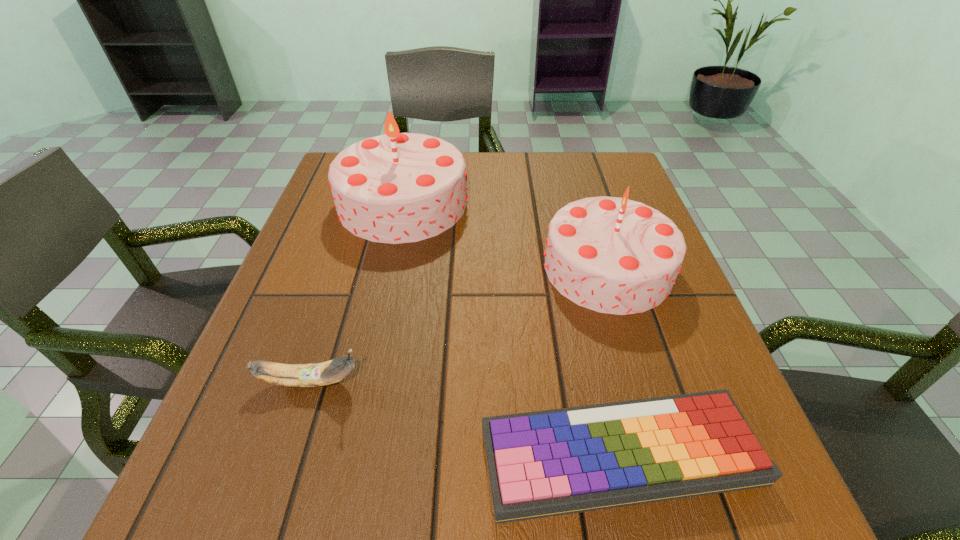
Identify the location of free location at the far edge of the desktop. (482, 171).

Where is `vacant space at the left edge`? vacant space at the left edge is located at coordinates (348, 294).

Where is `free region at the far right corner of the desktop`? Image resolution: width=960 pixels, height=540 pixels. free region at the far right corner of the desktop is located at coordinates (590, 166).

The height and width of the screenshot is (540, 960). I want to click on vacant area that lies between the left birthday cake and the banana, so click(x=357, y=292).

The height and width of the screenshot is (540, 960). Find the location of `vacant region between the third farthest object and the left birthday cake`. vacant region between the third farthest object and the left birthday cake is located at coordinates (357, 292).

At what (x,y) coordinates should I click in order to perform the action: click on free space between the right birthday cake and the taller birthday cake. Please return your answer as a coordinate pair (x, y). Looking at the image, I should click on [x=506, y=235].

This screenshot has height=540, width=960. I want to click on free point between the second shortest object and the tallest object, so coord(357,292).

At what (x,y) coordinates should I click in order to perform the action: click on free space between the banana and the third shortest object. Please return your answer as a coordinate pair (x, y). Image resolution: width=960 pixels, height=540 pixels. Looking at the image, I should click on (459, 325).

This screenshot has height=540, width=960. Find the location of `free space between the third shortest object and the taller birthday cake`. free space between the third shortest object and the taller birthday cake is located at coordinates (506, 235).

Find the location of a particular element. unoccupied area between the second shortest object and the right birthday cake is located at coordinates (459, 325).